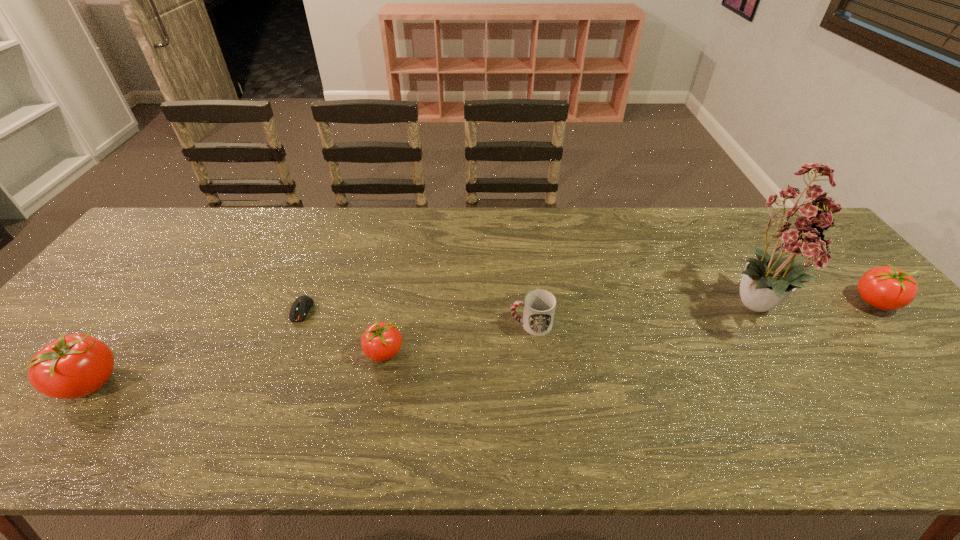
The image size is (960, 540). Identify the location of object that is positioned at the left edge. (73, 366).

In order to click on object at the right edge in this screenshot , I will do `click(887, 288)`.

Identify the location of object that is at the near left corner. (73, 366).

You are a GUI agent. You are given a task and a screenshot of the screen. Output one action in this format:
    pyautogui.click(x=<x>, y=<y>)
    Task: Click on the vacant area at the far edge
    
    Given the screenshot: What is the action you would take?
    pyautogui.click(x=405, y=237)

Where is `free location at the near edge`? This screenshot has width=960, height=540. free location at the near edge is located at coordinates (887, 410).

Locate an element on the screen. This screenshot has height=540, width=960. vacant region at the right edge of the desktop is located at coordinates (841, 264).

Locate an element on the screen. free space at the far left corner of the desktop is located at coordinates (155, 239).

Find the location of a particular element. blank space at the far right corner of the desktop is located at coordinates [749, 211].

The image size is (960, 540). I want to click on free space between the fourth object from left to right and the farthest tomato, so click(x=703, y=313).

Image resolution: width=960 pixels, height=540 pixels. Find the location of `free space between the third object from right to left and the shortest object`. free space between the third object from right to left and the shortest object is located at coordinates (417, 318).